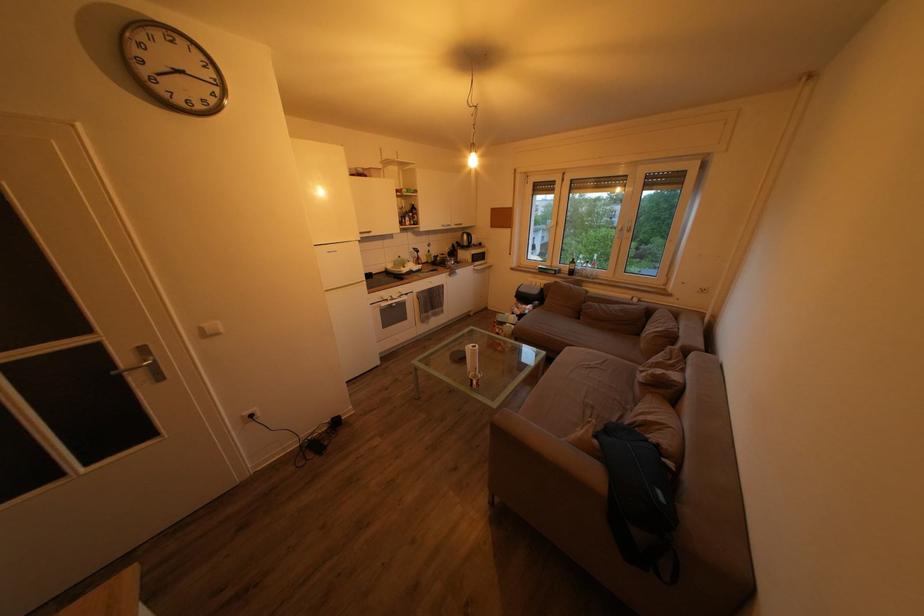
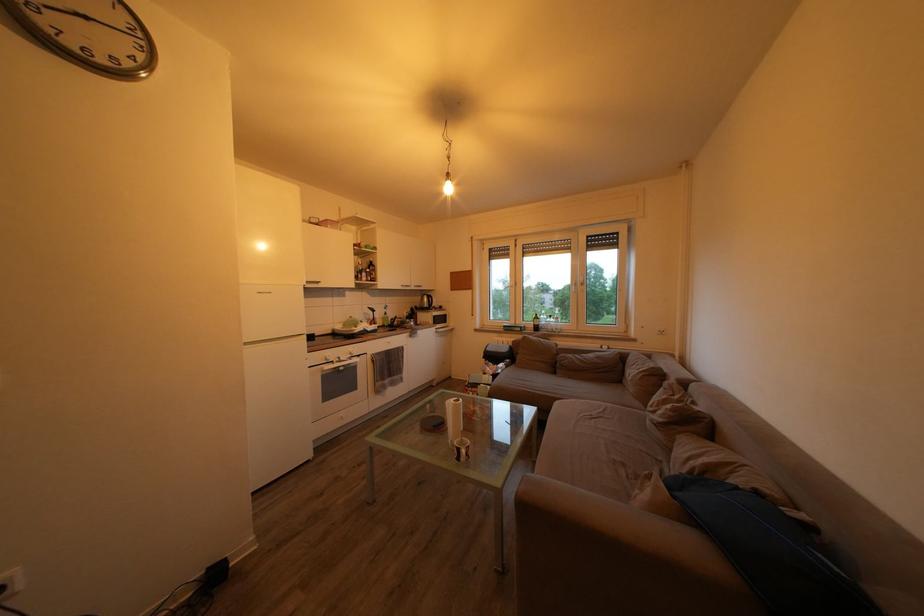
In the second image, find the point that corresponds to pixel 480 387 in the first image.

(467, 456)